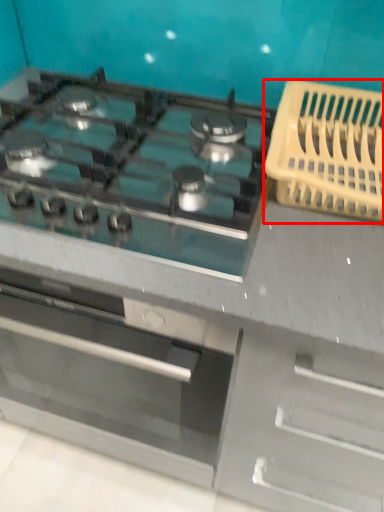
Question: From the image's perspective, what is the correct spatial positioning of basket (annotated by the red box) in reference to gas stove?

Choices:
 (A) below
 (B) above

Answer: (B)